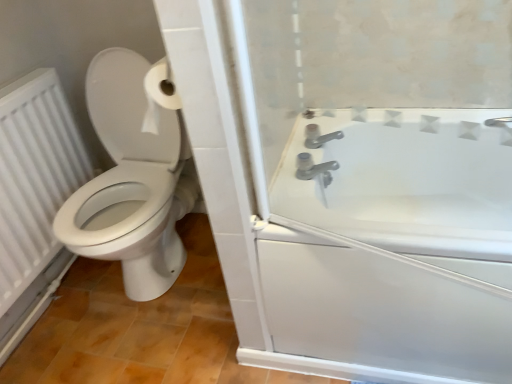
You are a GUI agent. You are given a task and a screenshot of the screen. Output one action in this format:
    pyautogui.click(x=<x>, y=<y>)
    Task: Click on the free space in front of satin nickel faucet at upper right
    The image size is (512, 384).
    Given the screenshot: What is the action you would take?
    (306, 217)